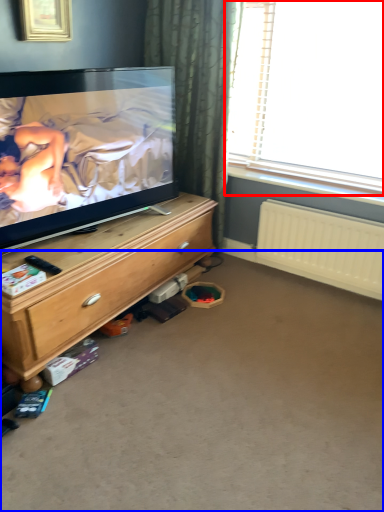
Question: Which object appears farthest to the camera in this image, window (highlighted by a red box) or plain (highlighted by a blue box)?

Choices:
 (A) window
 (B) plain

Answer: (A)